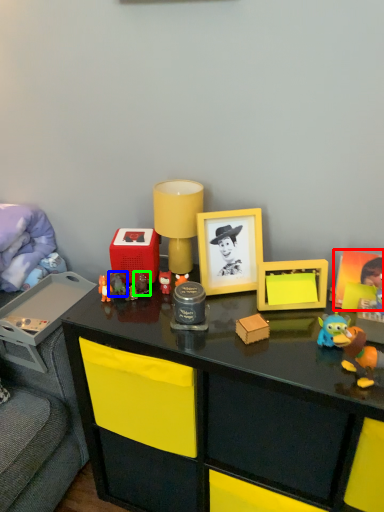
Question: Based on their relative distances, which object is farther from picture frame (highlighted by a red box)? Choose from toy (highlighted by a blue box) and toy (highlighted by a green box).

Choices:
 (A) toy
 (B) toy

Answer: (A)